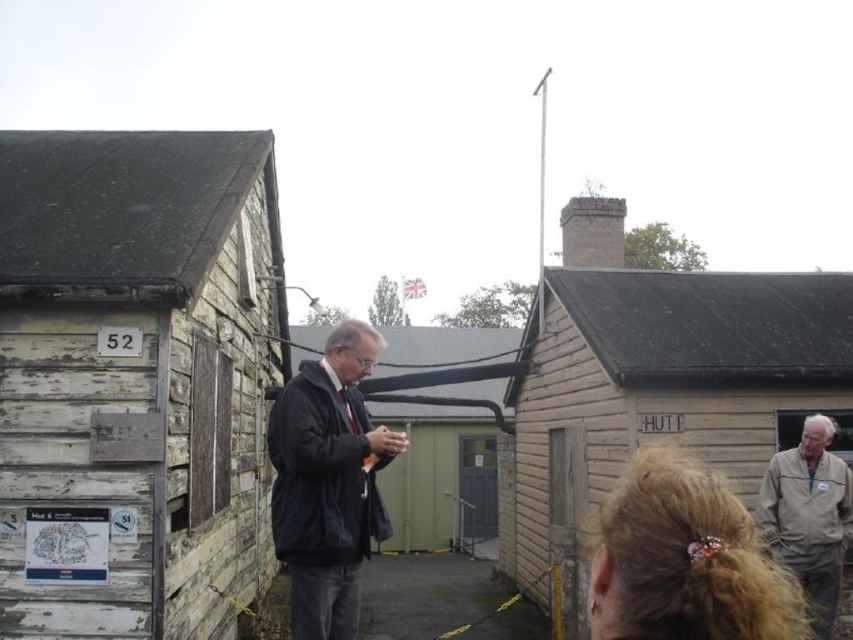
In the scene shown: You are standing at the point with coordinates [665,387]. What object are you standing on?

You are standing on the wooden hut at right.

You are a visitor at a historical site and see the weathered wood hut at left and the dark blue jacket at center. Which object is positioned to the left of the other?

The weathered wood hut at left is to the left of dark blue jacket at center.

You are a visitor at this historical site and want to take a photo of the wooden hut at right without the tan fabric jacket at lower right appearing in the shot. How should you position yourself?

Move to the side of the wooden hut at right so that the tan fabric jacket at lower right is no longer blocking the view. Since the tan fabric jacket at lower right is behind the wooden hut at right, positioning yourself to the side would allow you to capture the hut without the jacket in the frame.